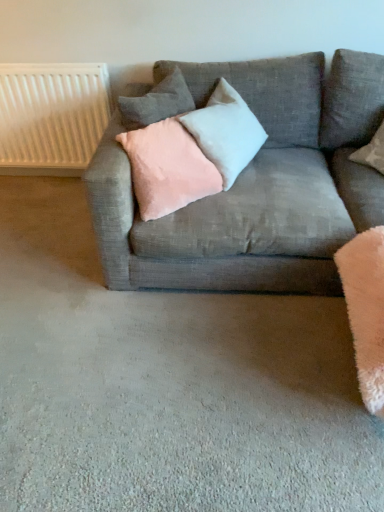
Question: Is pink velvet pillow at upper center, which appears as the first pillow when viewed from the top, shorter than white textured radiator at upper left?

Choices:
 (A) no
 (B) yes

Answer: (B)

Question: Is pink velvet pillow at upper center, which is the 3th pillow in bottom-to-top order, turned away from white textured radiator at upper left?

Choices:
 (A) no
 (B) yes

Answer: (A)

Question: Is pink velvet pillow at upper center, which is the 3th pillow in bottom-to-top order, touching white textured radiator at upper left?

Choices:
 (A) yes
 (B) no

Answer: (B)

Question: Would you say pink velvet pillow at upper center, which is the 3th pillow in bottom-to-top order, contains white textured radiator at upper left?

Choices:
 (A) yes
 (B) no

Answer: (B)

Question: Does pink velvet pillow at upper center, which appears as the first pillow when viewed from the top, appear on the left side of white textured radiator at upper left?

Choices:
 (A) no
 (B) yes

Answer: (A)

Question: Can you confirm if pink velvet pillow at upper center, which appears as the first pillow when viewed from the top, is wider than white textured radiator at upper left?

Choices:
 (A) no
 (B) yes

Answer: (B)

Question: Can we say pink velvet pillow at center, marked as the first pillow in a bottom-to-top arrangement, lies outside pink velvet pillow at upper center, which is the 3th pillow in bottom-to-top order?

Choices:
 (A) no
 (B) yes

Answer: (B)

Question: Is pink velvet pillow at center, marked as the first pillow in a bottom-to-top arrangement, oriented away from pink velvet pillow at upper center, which is the 3th pillow in bottom-to-top order?

Choices:
 (A) no
 (B) yes

Answer: (B)

Question: Is there a large distance between pink velvet pillow at center, which is the third pillow in top-to-bottom order, and pink velvet pillow at upper center, which is the 3th pillow in bottom-to-top order?

Choices:
 (A) no
 (B) yes

Answer: (A)

Question: Does pink velvet pillow at center, which is the third pillow in top-to-bottom order, have a larger size compared to pink velvet pillow at upper center, which is the 3th pillow in bottom-to-top order?

Choices:
 (A) no
 (B) yes

Answer: (B)

Question: Can you confirm if pink velvet pillow at center, marked as the first pillow in a bottom-to-top arrangement, is shorter than pink velvet pillow at upper center, which appears as the first pillow when viewed from the top?

Choices:
 (A) no
 (B) yes

Answer: (A)

Question: Would you say pink velvet pillow at center, marked as the first pillow in a bottom-to-top arrangement, contains pink velvet pillow at upper center, which is the 3th pillow in bottom-to-top order?

Choices:
 (A) no
 (B) yes

Answer: (A)

Question: From the image's perspective, is pink velvet pillow at center, marked as the first pillow in a bottom-to-top arrangement, over textured gray couch at center?

Choices:
 (A) yes
 (B) no

Answer: (B)